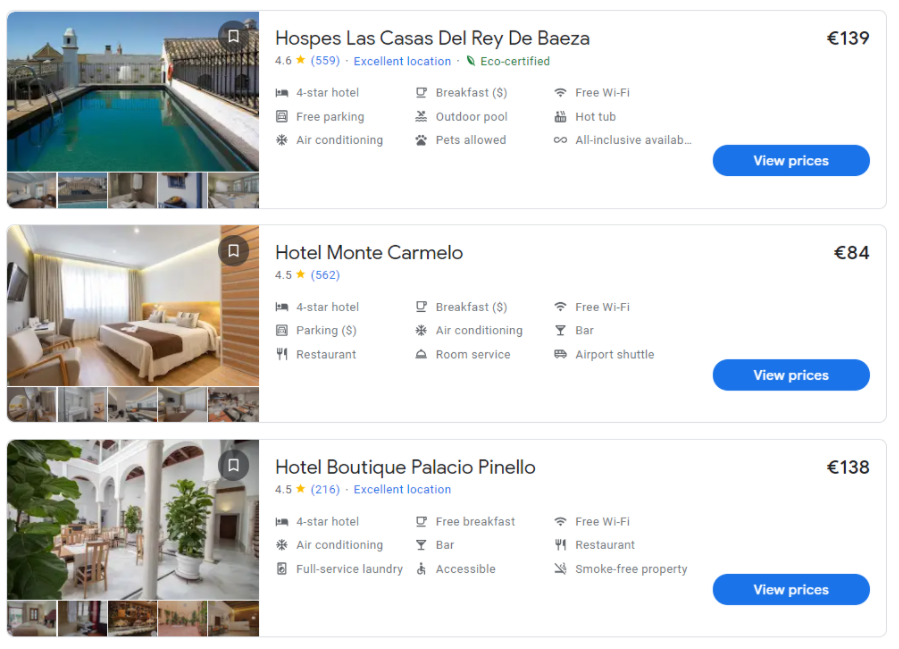
Where is `bed`? The height and width of the screenshot is (649, 899). bed is located at coordinates (165, 352).